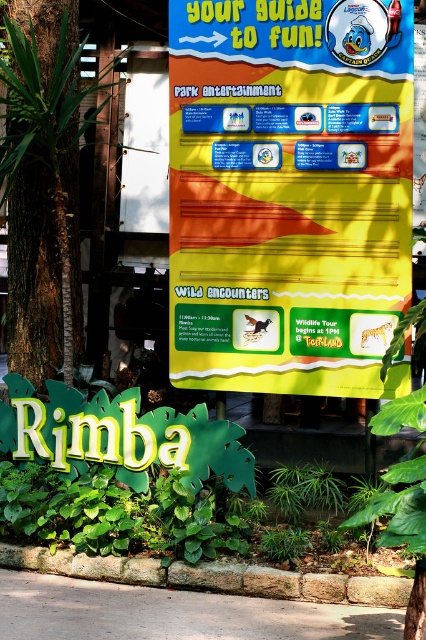
Identify the location of yellow paper sign at center. The image size is (426, 640). (290, 193).

Is yellow paper sign at center above green bark tree at left?

No.

The height and width of the screenshot is (640, 426). Describe the element at coordinates (290, 193) in the screenshot. I see `yellow paper sign at center` at that location.

Locate an element on the screen. yellow paper sign at center is located at coordinates point(290,193).